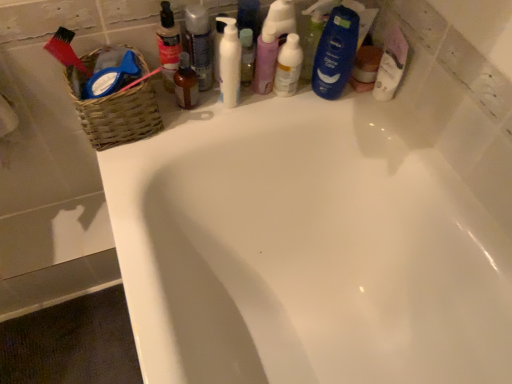
The height and width of the screenshot is (384, 512). Find the location of `free region on the left part of blue glossy shampoo bottle at upper right, the 1th toiletry viewed from the right`. free region on the left part of blue glossy shampoo bottle at upper right, the 1th toiletry viewed from the right is located at coordinates (258, 102).